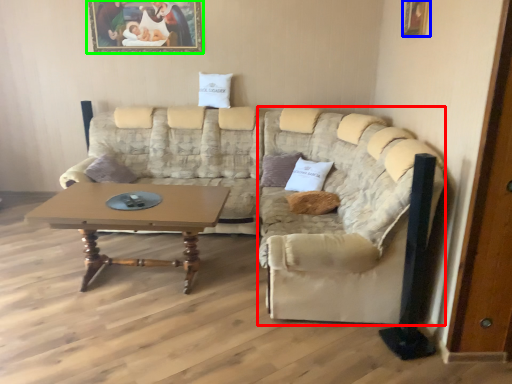
Question: Considering the real-world distances, which object is farthest from beige (highlighted by a red box)? picture frame (highlighted by a blue box) or picture frame (highlighted by a green box)?

Choices:
 (A) picture frame
 (B) picture frame

Answer: (B)